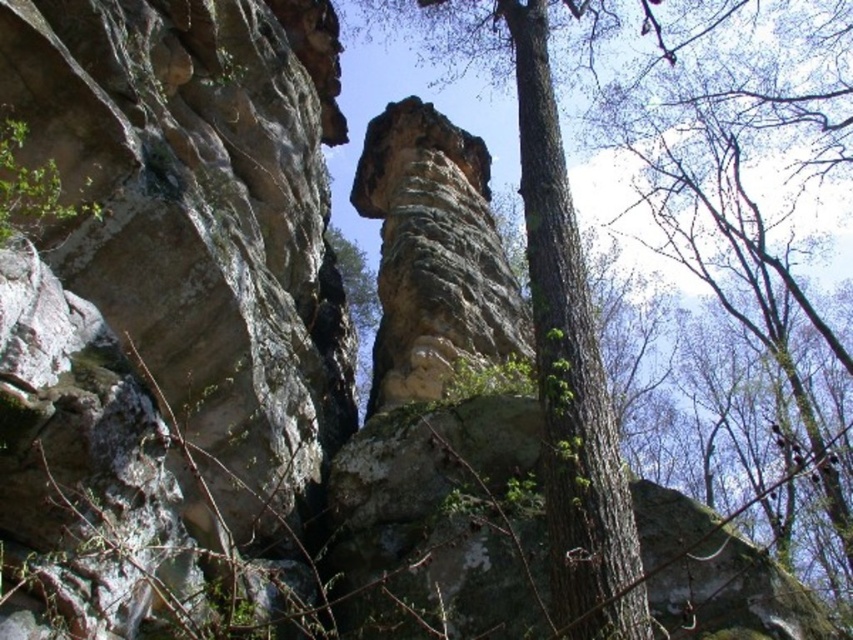
Is green mossy bark tree at center smaller than rusty stone column at center?

Incorrect, green mossy bark tree at center is not smaller in size than rusty stone column at center.

Can you confirm if green mossy bark tree at center is wider than rusty stone column at center?

Yes.

Locate an element on the screen. The image size is (853, 640). green mossy bark tree at center is located at coordinates (548, 275).

You are a GUI agent. You are given a task and a screenshot of the screen. Output one action in this format:
    pyautogui.click(x=<x>, y=<y>)
    Task: Click on the green mossy bark tree at center
    Image resolution: width=853 pixels, height=640 pixels.
    Given the screenshot: What is the action you would take?
    pyautogui.click(x=548, y=275)